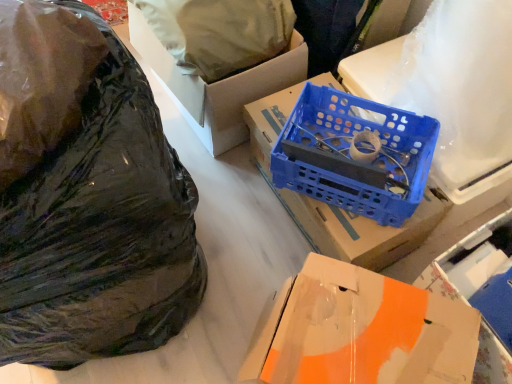
Question: Can you confirm if blue plastic crate at center, which appears as the second box when ordered from the bottom, is wider than blue plastic wire at center?

Choices:
 (A) no
 (B) yes

Answer: (B)

Question: Is blue plastic crate at center, which appears as the second box when ordered from the bottom, at the left side of blue plastic wire at center?

Choices:
 (A) yes
 (B) no

Answer: (B)

Question: Is blue plastic crate at center, arranged as the second box when viewed from the top, thinner than blue plastic wire at center?

Choices:
 (A) no
 (B) yes

Answer: (A)

Question: From a real-world perspective, is blue plastic crate at center, arranged as the second box when viewed from the top, over blue plastic wire at center?

Choices:
 (A) yes
 (B) no

Answer: (B)

Question: From the image's perspective, does blue plastic crate at center, arranged as the second box when viewed from the top, appear higher than blue plastic wire at center?

Choices:
 (A) yes
 (B) no

Answer: (A)

Question: Is blue plastic crate at center, which appears as the second box when ordered from the bottom, next to blue plastic wire at center and touching it?

Choices:
 (A) yes
 (B) no

Answer: (B)

Question: From a real-world perspective, does glossy plastic bag at left, the first plastic bag in the back-to-front sequence, stand above blue plastic crate at center, which appears as the second box when ordered from the bottom?

Choices:
 (A) no
 (B) yes

Answer: (B)

Question: Is glossy plastic bag at left, the first plastic bag in the back-to-front sequence, not close to blue plastic crate at center, arranged as the second box when viewed from the top?

Choices:
 (A) no
 (B) yes

Answer: (A)

Question: From the image's perspective, is glossy plastic bag at left, the first plastic bag in the back-to-front sequence, located above blue plastic crate at center, arranged as the second box when viewed from the top?

Choices:
 (A) yes
 (B) no

Answer: (A)

Question: Considering the relative sizes of glossy plastic bag at left, acting as the 2th plastic bag starting from the front, and blue plastic crate at center, arranged as the second box when viewed from the top, in the image provided, is glossy plastic bag at left, acting as the 2th plastic bag starting from the front, taller than blue plastic crate at center, arranged as the second box when viewed from the top,?

Choices:
 (A) yes
 (B) no

Answer: (B)

Question: Is glossy plastic bag at left, acting as the 2th plastic bag starting from the front, directly adjacent to blue plastic crate at center, which appears as the second box when ordered from the bottom?

Choices:
 (A) no
 (B) yes

Answer: (A)

Question: Is glossy plastic bag at left, acting as the 2th plastic bag starting from the front, to the right of blue plastic crate at center, which appears as the second box when ordered from the bottom, from the viewer's perspective?

Choices:
 (A) yes
 (B) no

Answer: (B)

Question: Is black matte plastic bag at left, which is counted as the 2th plastic bag, starting from the back, far away from blue plastic crate at center, arranged as the second box when viewed from the top?

Choices:
 (A) no
 (B) yes

Answer: (A)